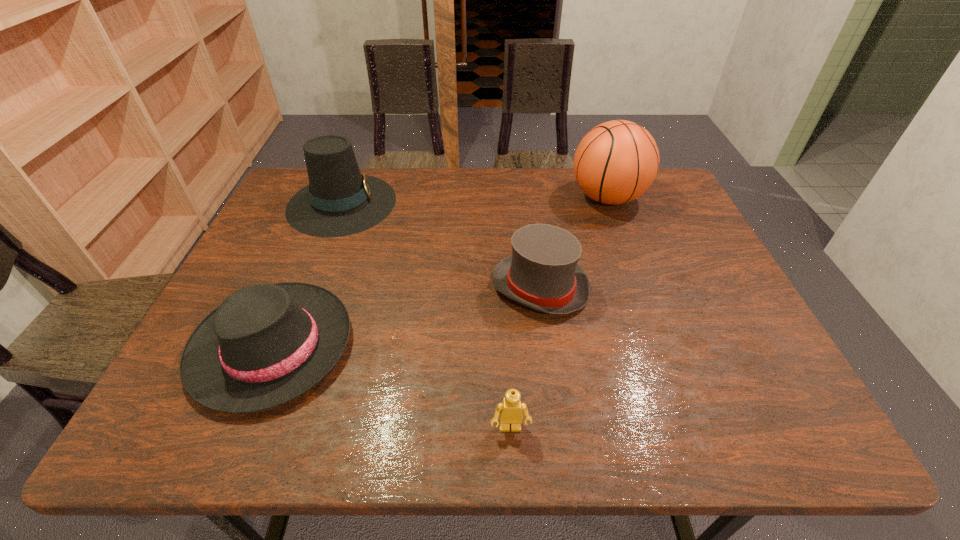
Where is `hat that is positioned at the far edge`? The height and width of the screenshot is (540, 960). hat that is positioned at the far edge is located at coordinates (339, 201).

Where is `dress hat positioned at the near edge`? dress hat positioned at the near edge is located at coordinates (266, 344).

In order to click on Lego situated at the near edge in this screenshot , I will do `click(511, 410)`.

Locate an element on the screen. The width and height of the screenshot is (960, 540). object that is at the right edge is located at coordinates (616, 162).

Locate an element on the screen. The width and height of the screenshot is (960, 540). object present at the far left corner is located at coordinates (339, 201).

I want to click on object at the near left corner, so click(266, 344).

The width and height of the screenshot is (960, 540). I want to click on object positioned at the far right corner, so click(x=616, y=162).

Where is `blank area at the far edge`? The height and width of the screenshot is (540, 960). blank area at the far edge is located at coordinates (461, 180).

You are a GUI agent. You are given a task and a screenshot of the screen. Output one action in this format:
    pyautogui.click(x=<x>, y=<y>)
    Task: Click on the vacant space at the near edge of the desktop
    This screenshot has width=960, height=540.
    Given the screenshot: What is the action you would take?
    pyautogui.click(x=659, y=428)

The width and height of the screenshot is (960, 540). In order to click on vacant space in between the fourth shortest object and the rightmost dress hat in this screenshot , I will do `click(441, 245)`.